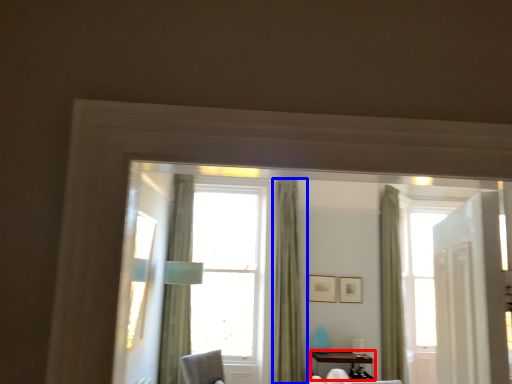
Question: Which object is further to the camera taking this photo, table (highlighted by a red box) or curtain (highlighted by a blue box)?

Choices:
 (A) table
 (B) curtain

Answer: (B)